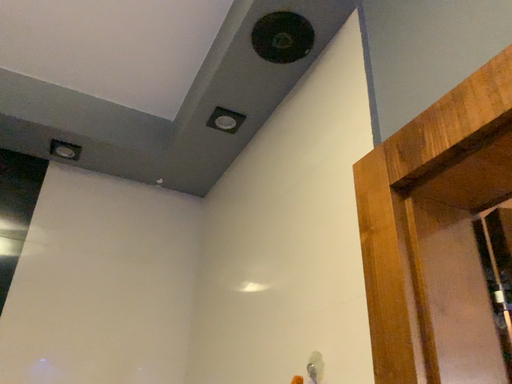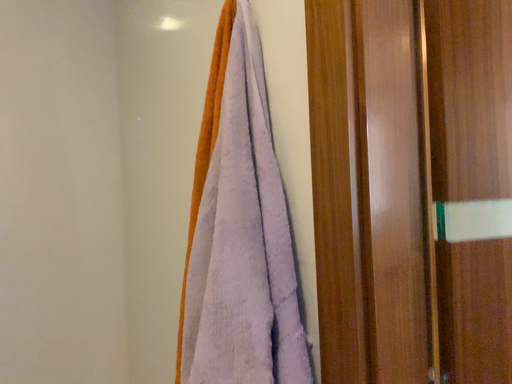
Question: Which way did the camera rotate in the video?

Choices:
 (A) rotated upward
 (B) rotated downward

Answer: (B)